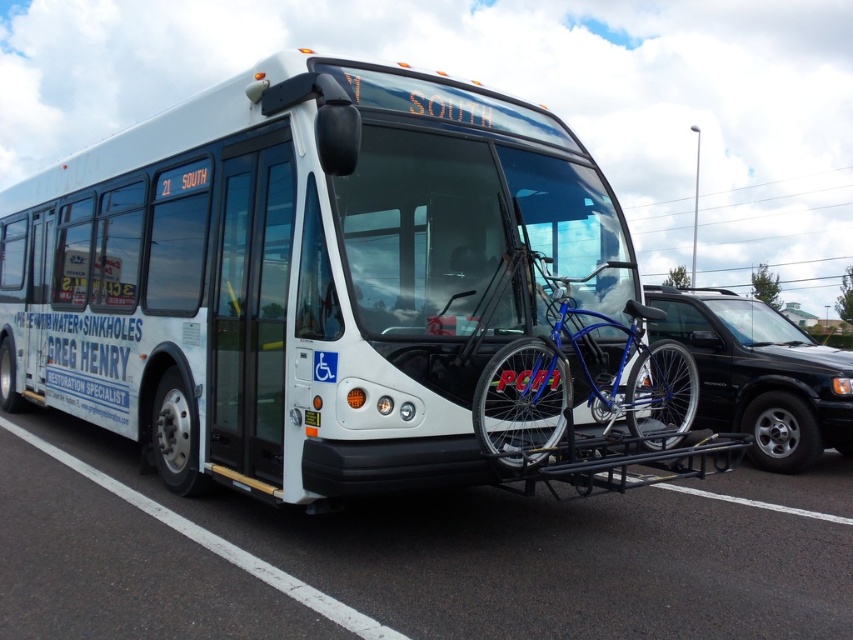
Can you confirm if white matte bus at center is positioned above blue metallic bicycle at center?

Indeed, white matte bus at center is positioned over blue metallic bicycle at center.

Does white matte bus at center have a smaller size compared to blue metallic bicycle at center?

Yes.

This screenshot has width=853, height=640. What do you see at coordinates (296, 275) in the screenshot?
I see `white matte bus at center` at bounding box center [296, 275].

Identify the location of white matte bus at center. (296, 275).

How far apart are black asphalt at lower center and black matte suv at right?

black asphalt at lower center and black matte suv at right are 6.01 meters apart.

Is point (223, 625) more distant than point (846, 417)?

No, it is not.

Image resolution: width=853 pixels, height=640 pixels. Find the location of `black asphalt at lower center`. black asphalt at lower center is located at coordinates (410, 556).

Which is in front, point (665, 348) or point (828, 428)?

Point (665, 348)

Which is more to the left, blue metallic bicycle at center or black matte suv at right?

blue metallic bicycle at center

Where is `blue metallic bicycle at center`? The height and width of the screenshot is (640, 853). blue metallic bicycle at center is located at coordinates (579, 381).